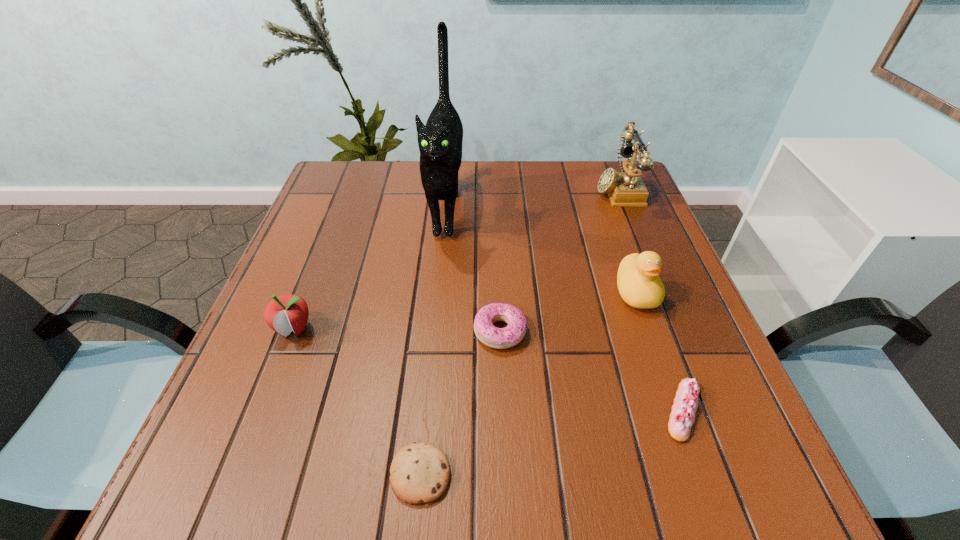
You are a GUI agent. You are given a task and a screenshot of the screen. Output one action in this format:
    pyautogui.click(x=<x>, y=<y>)
    Task: Click on the tallest object
    The image size is (960, 540).
    Given the screenshot: What is the action you would take?
    click(440, 142)

Where is `telephone`? The image size is (960, 540). telephone is located at coordinates (625, 189).

Locate an element on the screen. Image resolution: width=960 pixels, height=540 pixels. duck is located at coordinates click(639, 285).

Locate an element on the screen. the fourth shortest object is located at coordinates (286, 313).

Locate an element on the screen. The height and width of the screenshot is (540, 960). the leftmost object is located at coordinates (286, 313).

What are the coordinates of `doughnut` in the screenshot? It's located at (499, 338).

The height and width of the screenshot is (540, 960). Find the location of `the fifth tallest object`. the fifth tallest object is located at coordinates (499, 338).

This screenshot has width=960, height=540. Identify the location of eclair. (682, 417).

Locate an element on the screen. the second nearest object is located at coordinates (682, 417).

The height and width of the screenshot is (540, 960). In order to click on the shortest object in this screenshot , I will do `click(419, 473)`.